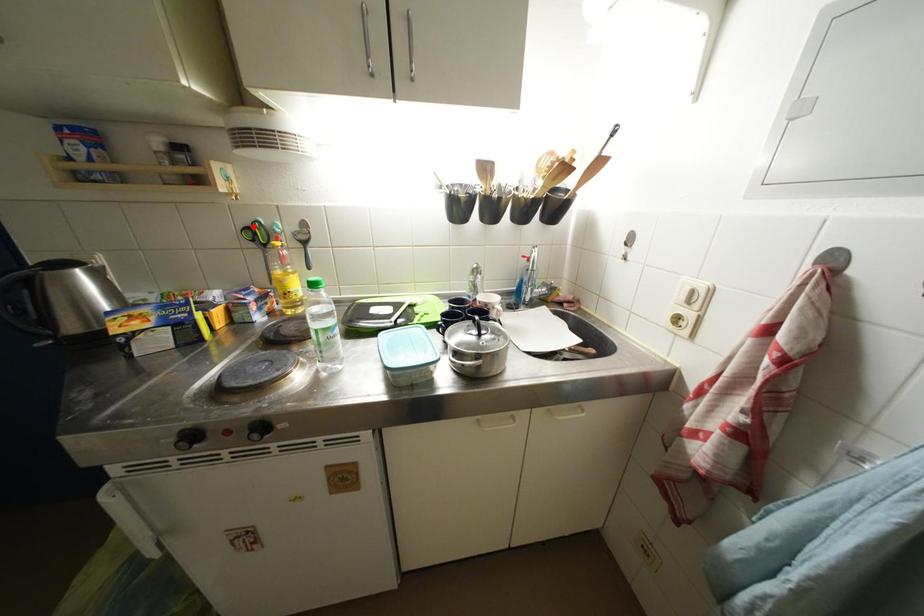
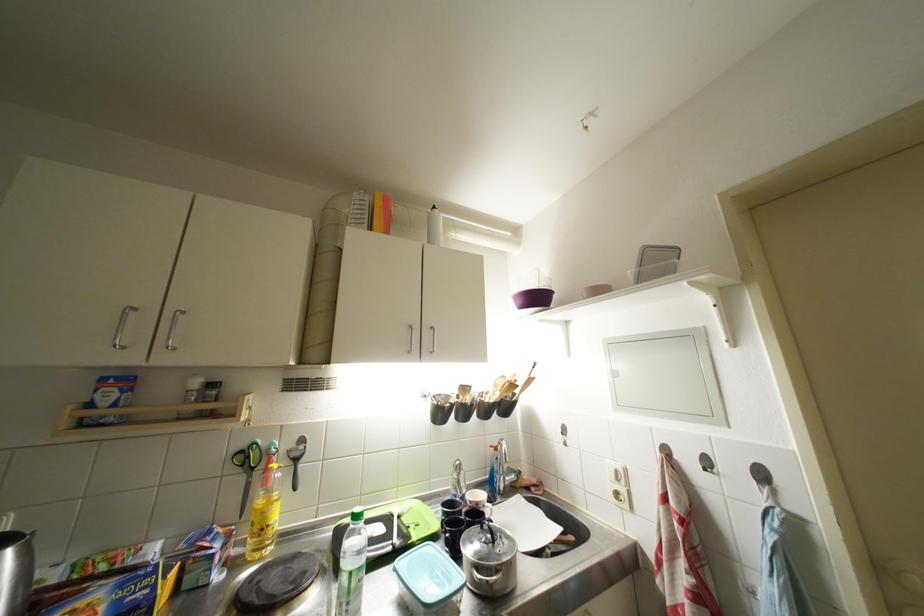
Find the pixel in the second image that matches the highlighted location in the first image.

(249, 450)